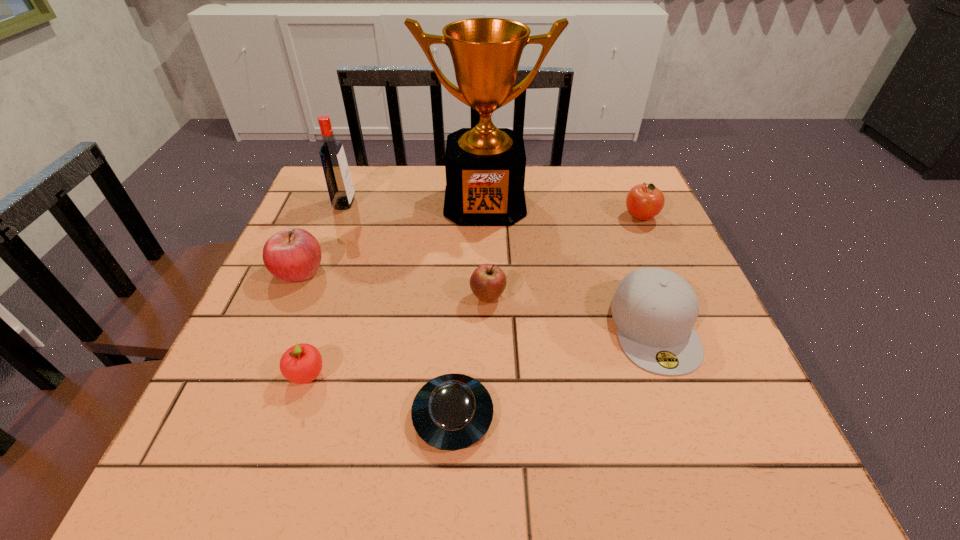
You are a GUI agent. You are given a task and a screenshot of the screen. Output one action in this format:
    pyautogui.click(x=<x>, y=<y>)
    Task: Click on the vodka that is at the left edge
    The height and width of the screenshot is (540, 960).
    Given the screenshot: What is the action you would take?
    pyautogui.click(x=336, y=171)

Where is `apple that is at the right edge`? This screenshot has width=960, height=540. apple that is at the right edge is located at coordinates (644, 201).

At what (x,y) coordinates should I click in order to perform the action: click on cap located at the right edge. Please return your answer as a coordinate pair (x, y). This screenshot has height=540, width=960. Looking at the image, I should click on (655, 309).

Where is `object present at the far left corner`? object present at the far left corner is located at coordinates (336, 171).

The width and height of the screenshot is (960, 540). In order to click on object present at the far right corner in this screenshot , I will do `click(644, 201)`.

Where is `vacant space at the far edge of the desktop`? This screenshot has height=540, width=960. vacant space at the far edge of the desktop is located at coordinates (384, 180).

This screenshot has height=540, width=960. I want to click on free spot at the near edge of the desktop, so click(x=675, y=476).

In the image, there is a desktop. Where is `blank space at the left edge`? This screenshot has width=960, height=540. blank space at the left edge is located at coordinates (335, 258).

Locate an element on the screen. vacant region at the far left corner of the desktop is located at coordinates (370, 183).

The image size is (960, 540). I want to click on vacant space at the far right corner, so click(x=621, y=183).